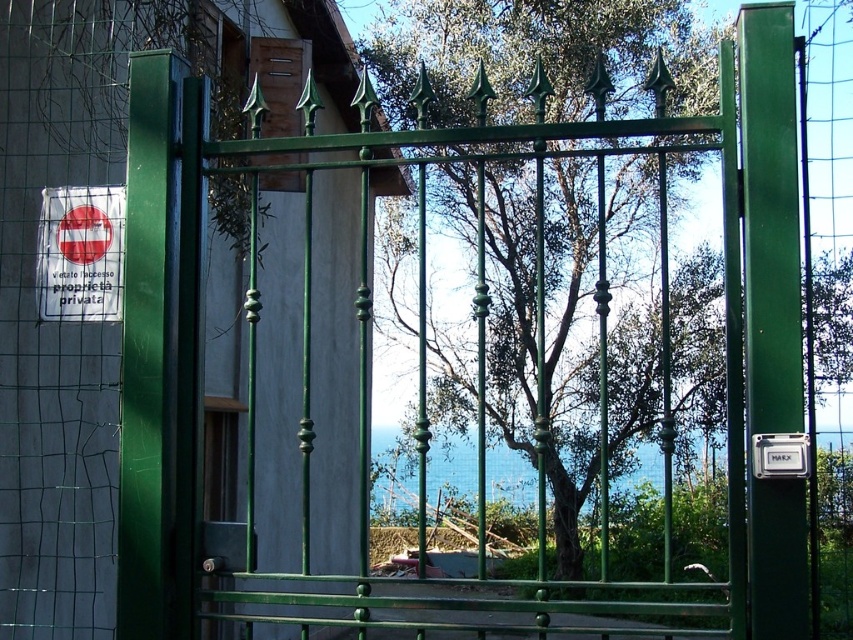
Question: Estimate the real-world distances between objects in this image. Which object is closer to the white plastic parking sign at right?

Choices:
 (A) green metal tree at center
 (B) white plastic sign at left

Answer: (B)

Question: Is white plastic sign at left above white plastic parking sign at right?

Choices:
 (A) no
 (B) yes

Answer: (B)

Question: Which point is closer to the camera taking this photo?

Choices:
 (A) (111, 252)
 (B) (773, 458)

Answer: (B)

Question: Which point is closer to the camera taking this photo?

Choices:
 (A) (107, 189)
 (B) (525, 168)
 (C) (791, 449)

Answer: (C)

Question: Can you confirm if green metal tree at center is positioned to the left of white plastic parking sign at right?

Choices:
 (A) yes
 (B) no

Answer: (B)

Question: Is green metal tree at center to the right of white plastic sign at left from the viewer's perspective?

Choices:
 (A) no
 (B) yes

Answer: (B)